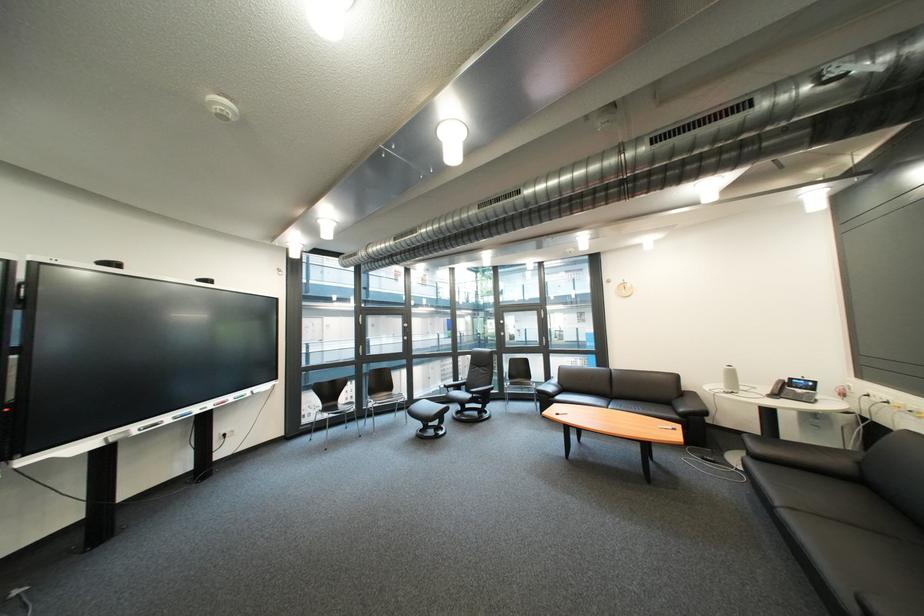
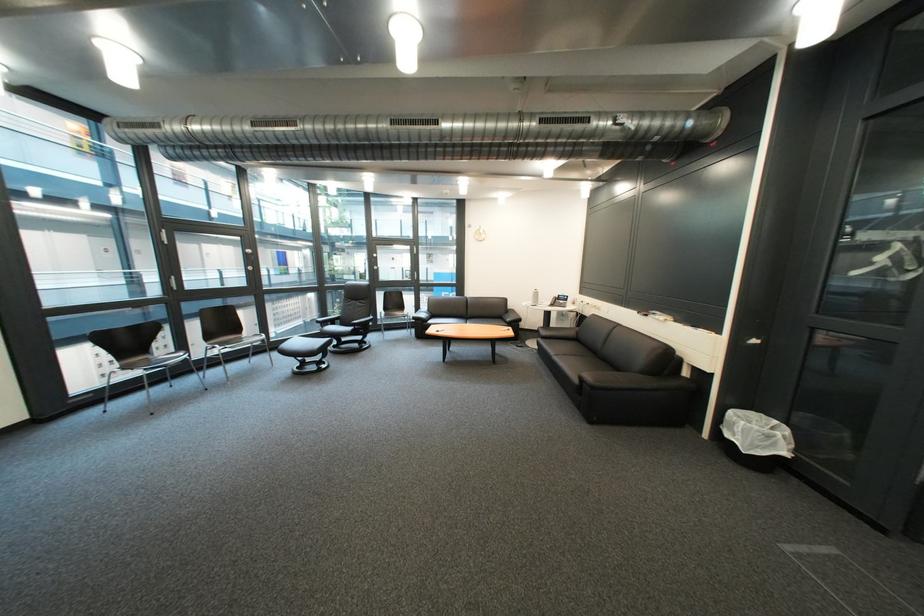
The point at [572,399] is marked in the first image. Where is the corresponding point in the second image?

(444, 323)